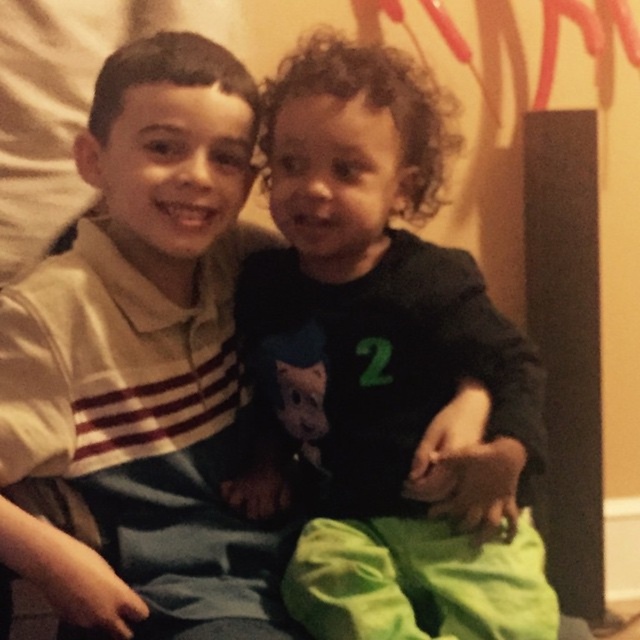
Does dark green jersey at center have a lesser height compared to white striped shirt at left?

Incorrect, dark green jersey at center's height does not fall short of white striped shirt at left's.

Who is higher up, dark green jersey at center or white striped shirt at left?

Positioned higher is dark green jersey at center.

Between point (323, 200) and point (144, 49), which one is positioned behind?

The point (144, 49) is behind.

At what (x,y) coordinates should I click in order to perform the action: click on dark green jersey at center. Please return your answer as a coordinate pair (x, y). This screenshot has height=640, width=640. Looking at the image, I should click on (387, 364).